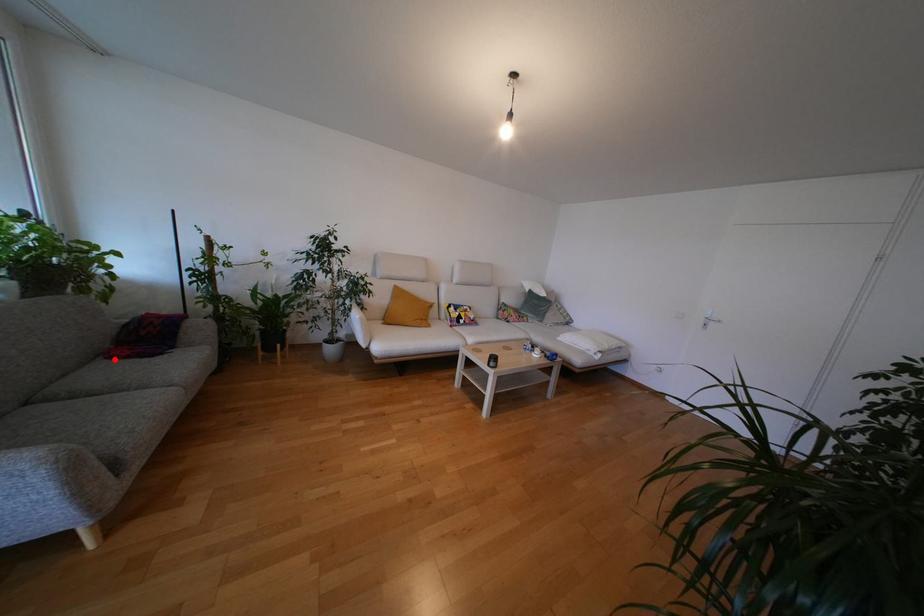
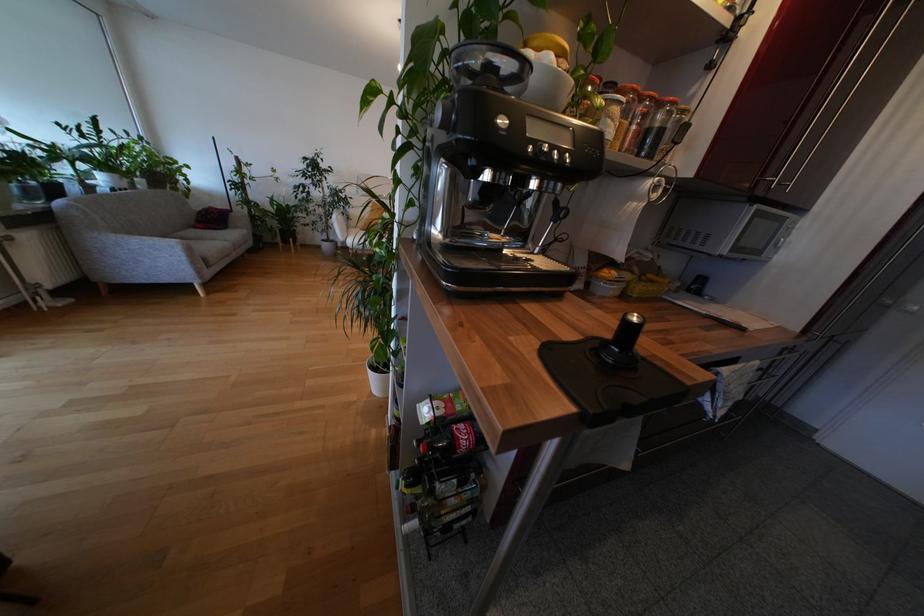
Where in the second image is the point corresponding to the highlighted location from the first image?

(200, 230)